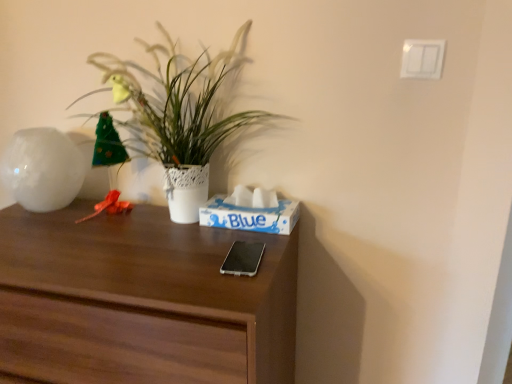
Locate an element on the screen. vacant space in front of white glossy vase at left is located at coordinates (35, 235).